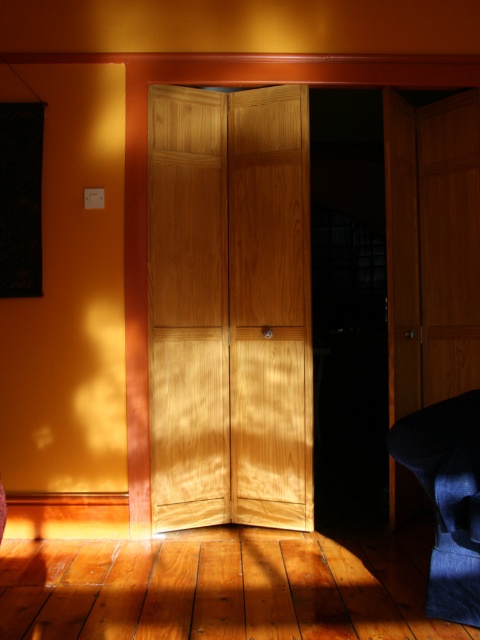
Looking at this image, you are sitting in the denim fabric armchair at lower right and want to reach the light brown wood door at center. Can you stand up and walk directly to it without moving the chair?

The light brown wood door at center is above the denim fabric armchair at lower right, so you can stand up and walk directly to it without needing to move the chair since the door is positioned higher up and not blocking the path.

Consider the image. You are sitting in the denim fabric armchair at lower right and want to exit through the light brown wood door at center. Can you easily get up and move forward without any obstacles?

The denim fabric armchair at lower right is behind the light brown wood door at center, so you cannot easily get up and move forward without first moving around the door or opening it to create space.